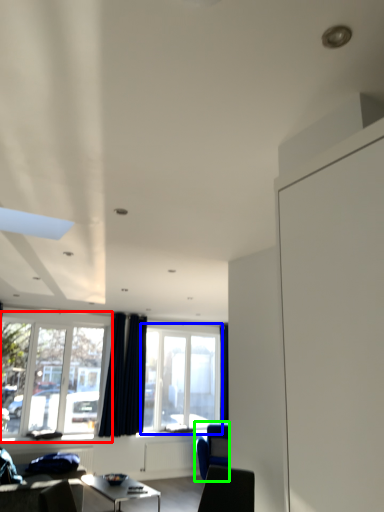
Question: Which is nearer to the window (highlighted by a red box)? window (highlighted by a blue box) or armchair (highlighted by a green box).

Choices:
 (A) window
 (B) armchair

Answer: (A)